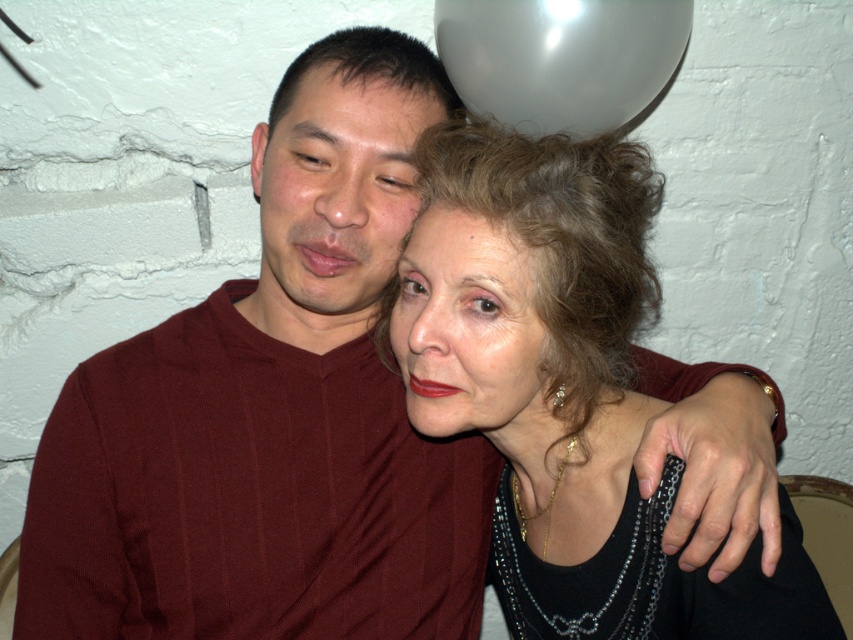
Based on the scene description, which object is positioned to the right of the other between the matte black face at center and the matte black forehead at upper center?

The matte black face at center is positioned to the right of the matte black forehead at upper center.